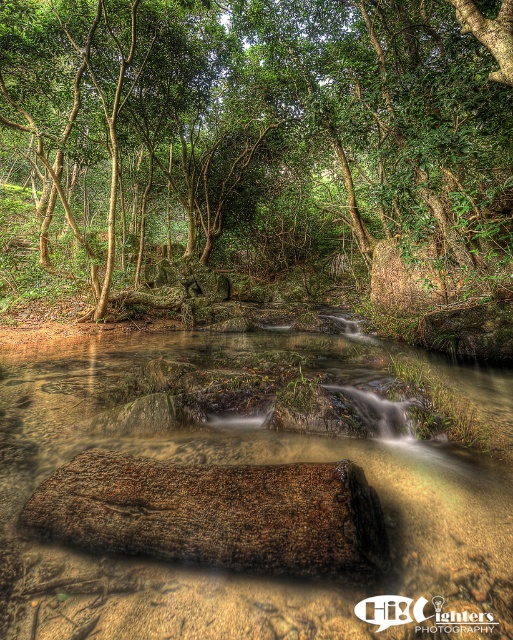
You are standing at the point marked by the coordinates point (263, 141) in the forest scene. Which object is exactly at your current location?

The green leafy tree at center is located at point (263, 141), so the object exactly at your current location is the green leafy tree at center.

You are a hiker trying to cross the stream. You see a green leafy tree at center and a brown rough wood at center. Which object is wider so you can use it as a natural bridge?

The green leafy tree at center is wider than the brown rough wood at center, so you can use the green leafy tree at center as a natural bridge.

You are a hiker who wants to cross the clear sediment river at center. There is a green leafy tree at center above the river. Can you use the tree to help cross the river?

The green leafy tree at center is positioned over the clear sediment river at center, so you can use the branches of the green leafy tree at center to help cross the river safely.